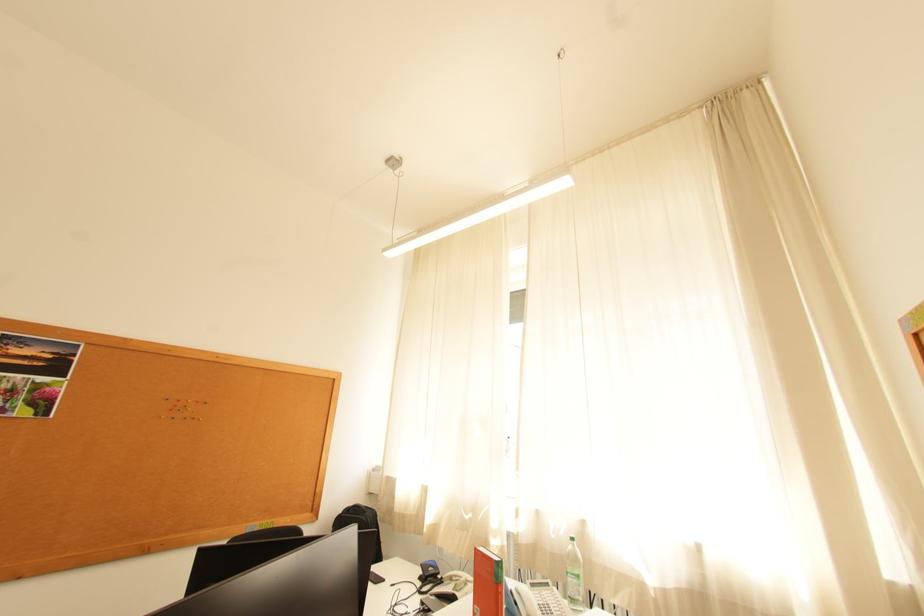
Find where to lift the telephone handset. Please return your answer as a coordinate pair (x, y).

(524, 599)